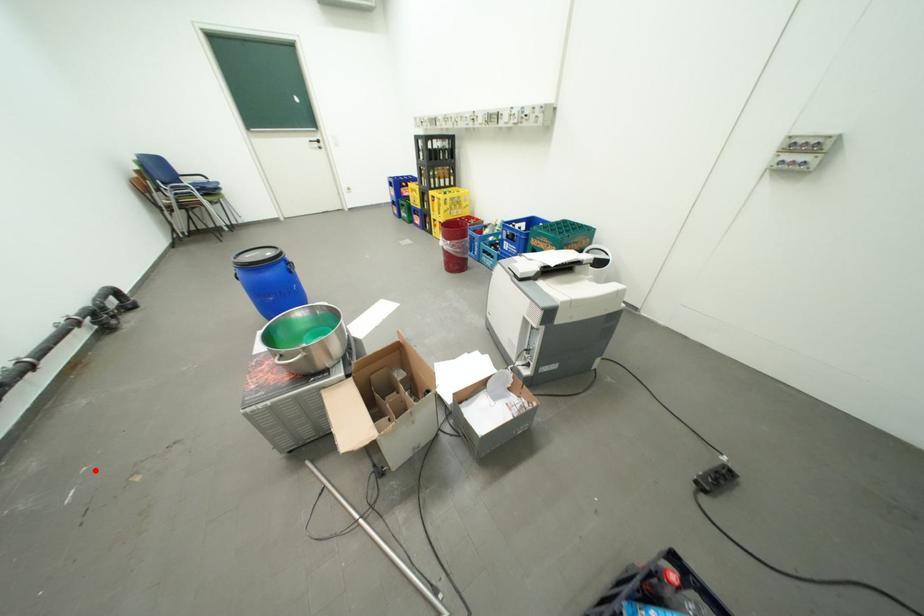
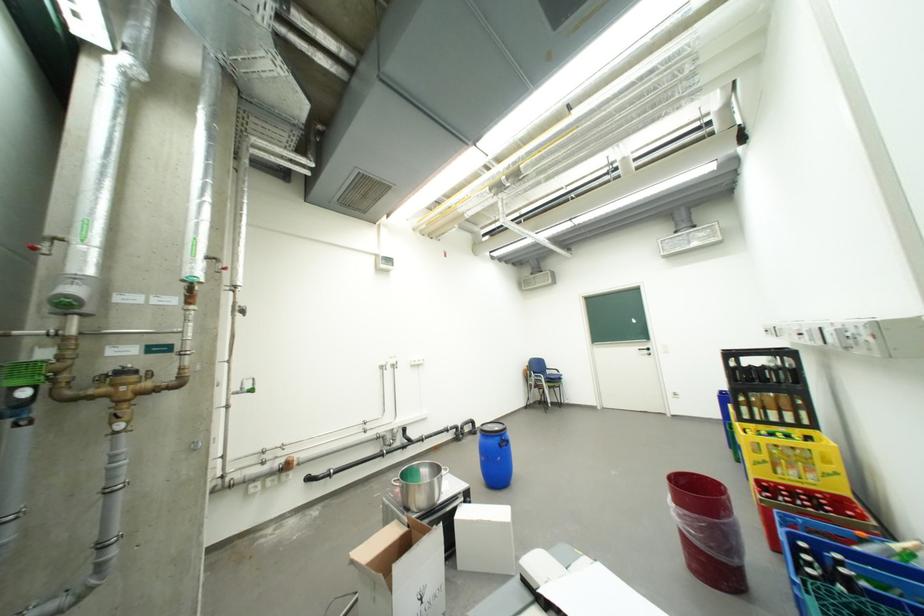
Question: I am providing you with two images of the same scene from different viewpoints. In image1, a red point is highlighted. Considering the same 3D point in image2, which of the following is correct?

Choices:
 (A) It is closer
 (B) It is farther

Answer: (B)